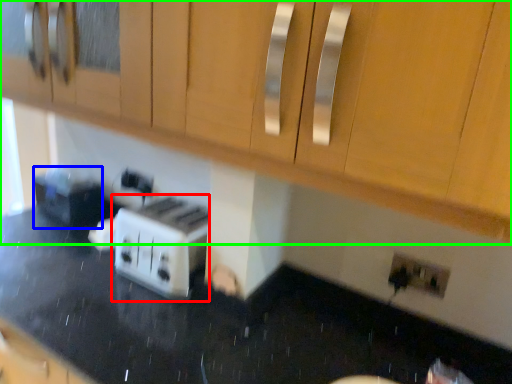
Question: Based on their relative distances, which object is farther from toaster (highlighted by a red box)? Choose from appliance (highlighted by a blue box) and cabinetry (highlighted by a green box).

Choices:
 (A) appliance
 (B) cabinetry

Answer: (A)